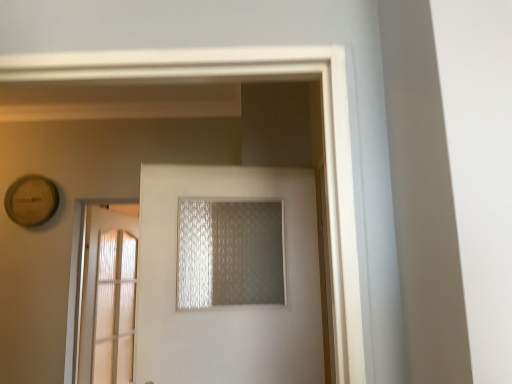
Question: Is white frosted glass door at center, the second door from the back, inside translucent textured glass at center?

Choices:
 (A) no
 (B) yes

Answer: (A)

Question: Does translucent textured glass at center come behind white frosted glass door at center, arranged as the 1th door when viewed from the front?

Choices:
 (A) no
 (B) yes

Answer: (B)

Question: Does translucent textured glass at center appear on the left side of white frosted glass door at center, which is the second door from left to right?

Choices:
 (A) yes
 (B) no

Answer: (B)

Question: Does translucent textured glass at center have a greater height compared to white frosted glass door at center, arranged as the 1th door when viewed from the front?

Choices:
 (A) yes
 (B) no

Answer: (B)

Question: Can you see translucent textured glass at center touching white frosted glass door at center, the second door from the back?

Choices:
 (A) yes
 (B) no

Answer: (B)

Question: Is white frosted glass door at center, which is the second door from left to right, inside or outside of clear glass door at left, positioned as the 2th door in right-to-left order?

Choices:
 (A) inside
 (B) outside

Answer: (B)

Question: Considering the positions of point (301, 286) and point (81, 352), is point (301, 286) closer or farther from the camera than point (81, 352)?

Choices:
 (A) farther
 (B) closer

Answer: (B)

Question: From the image's perspective, is white frosted glass door at center, the second door from the back, positioned above or below clear glass door at left, marked as the 1th door in a left-to-right arrangement?

Choices:
 (A) above
 (B) below

Answer: (A)

Question: Considering their positions, is white frosted glass door at center, the second door from the back, located in front of or behind clear glass door at left, the first door in the back-to-front sequence?

Choices:
 (A) behind
 (B) front

Answer: (B)

Question: Is white frosted glass door at center, the second door from the back, inside or outside of translucent textured glass at center?

Choices:
 (A) inside
 (B) outside

Answer: (B)

Question: From their relative heights in the image, would you say white frosted glass door at center, arranged as the 1th door when viewed from the front, is taller or shorter than translucent textured glass at center?

Choices:
 (A) short
 (B) tall

Answer: (B)

Question: From the image's perspective, is white frosted glass door at center, arranged as the 1th door when viewed from the front, above or below translucent textured glass at center?

Choices:
 (A) above
 (B) below

Answer: (B)

Question: Looking at the image, does white frosted glass door at center, arranged as the 1th door when viewed from the front, seem bigger or smaller compared to translucent textured glass at center?

Choices:
 (A) small
 (B) big

Answer: (B)

Question: In the image, is clear glass door at left, the first door in the back-to-front sequence, on the left side or the right side of white frosted glass door at center, which is counted as the first door, starting from the right?

Choices:
 (A) right
 (B) left

Answer: (B)

Question: In terms of size, does clear glass door at left, which is counted as the second door, starting from the front, appear bigger or smaller than white frosted glass door at center, which is counted as the first door, starting from the right?

Choices:
 (A) big
 (B) small

Answer: (A)